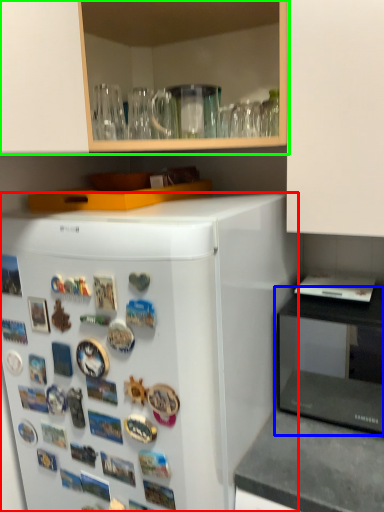
Question: Which object is the closest to the refrigerator (highlighted by a red box)? Choose among these: appliance (highlighted by a blue box) or cabinetry (highlighted by a green box).

Choices:
 (A) appliance
 (B) cabinetry

Answer: (B)